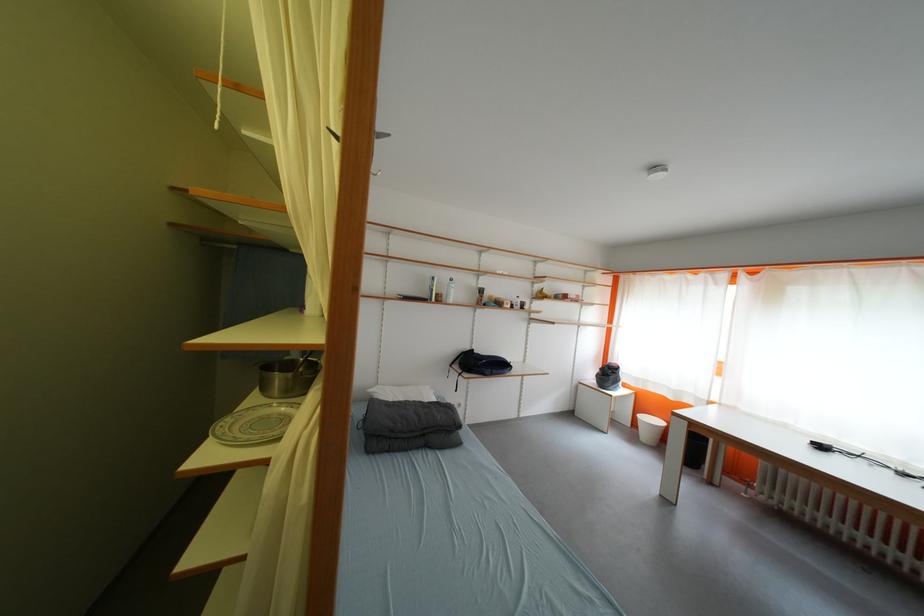
Where is `white water bottle`? The height and width of the screenshot is (616, 924). white water bottle is located at coordinates (448, 291).